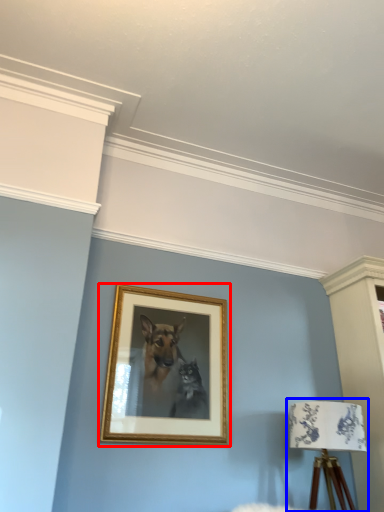
Question: Which point is further to the camera, picture frame (highlighted by a red box) or table lamp (highlighted by a blue box)?

Choices:
 (A) picture frame
 (B) table lamp

Answer: (A)